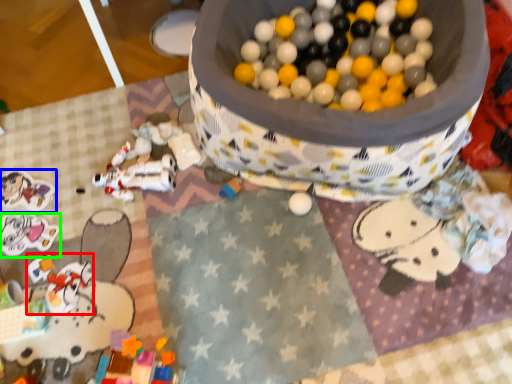
Question: Which object is the closest to the toy (highlighted by a red box)? Choose among these: toy (highlighted by a blue box) or toy (highlighted by a green box).

Choices:
 (A) toy
 (B) toy

Answer: (B)